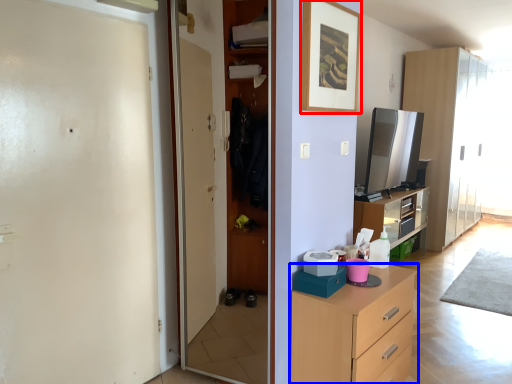
Question: Which point is further to the camera, picture frame (highlighted by a red box) or chest of drawers (highlighted by a blue box)?

Choices:
 (A) picture frame
 (B) chest of drawers

Answer: (A)